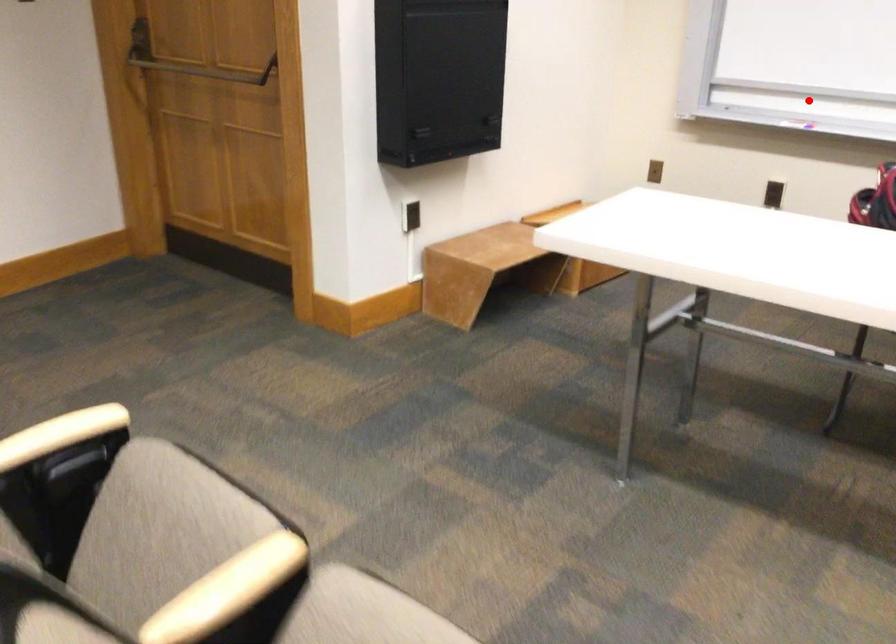
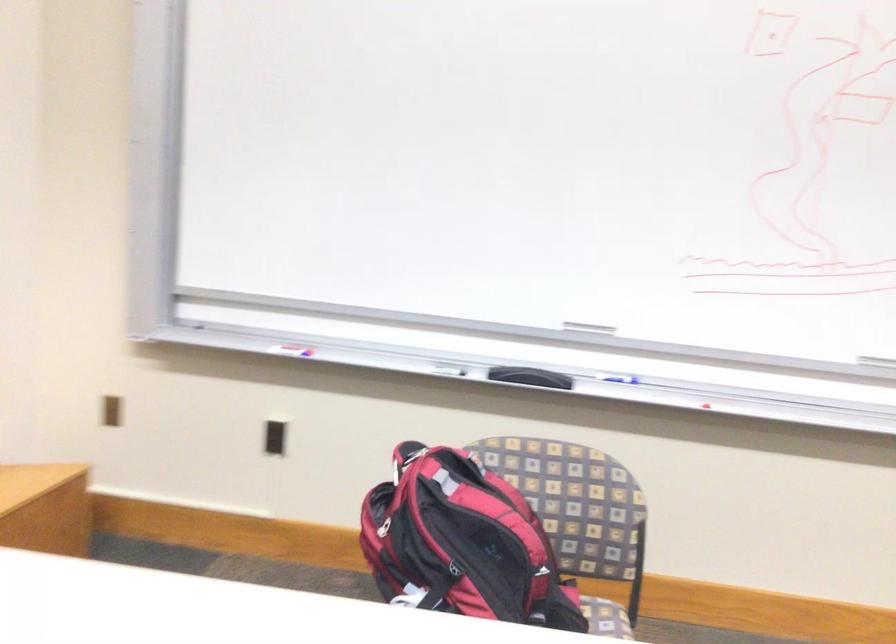
Locate, in the second image, the point that corresponds to the highlighted location in the first image.

(288, 345)